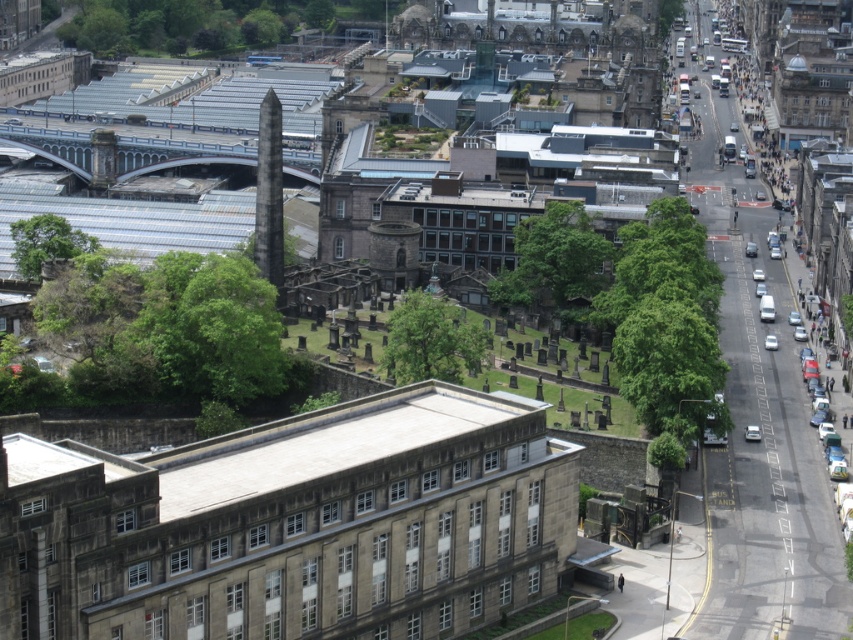
Question: Is silver metallic car at center-right below white matte car at right?

Choices:
 (A) yes
 (B) no

Answer: (A)

Question: Which point appears farthest from the camera in this image?

Choices:
 (A) (761, 273)
 (B) (752, 436)
 (C) (770, 346)

Answer: (A)

Question: Does silver metallic car at center-right lie behind white matte car at right?

Choices:
 (A) yes
 (B) no

Answer: (B)

Question: Which of these objects is positioned farthest from the white matte car at right?

Choices:
 (A) silver metallic car at center-right
 (B) metallic silver car at center-right

Answer: (B)

Question: Does white matte car at right lie behind metallic silver car at center-right?

Choices:
 (A) no
 (B) yes

Answer: (A)

Question: Which of the following is the closest to the observer?

Choices:
 (A) (764, 339)
 (B) (757, 428)

Answer: (B)